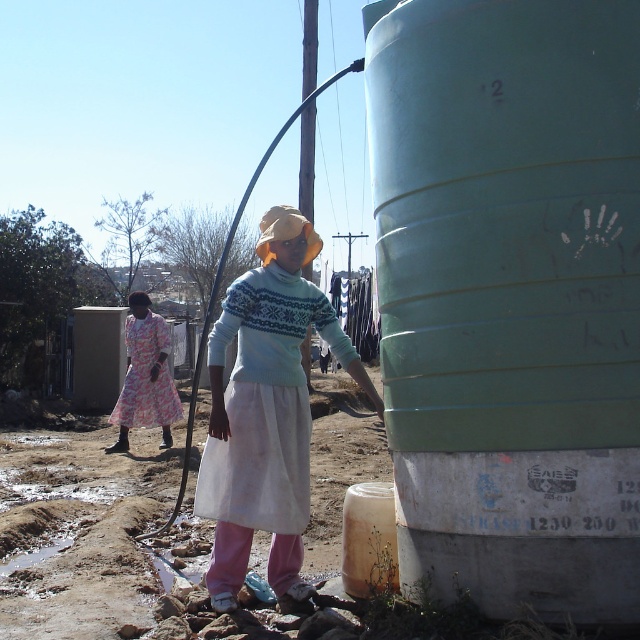
Question: Can you confirm if light blue plastic barrel at center is positioned to the right of light blue sweater at center?

Choices:
 (A) no
 (B) yes

Answer: (B)

Question: Does brown dirt at lower left appear under light blue sweater at center?

Choices:
 (A) yes
 (B) no

Answer: (A)

Question: Does light blue plastic barrel at center have a greater width compared to floral cotton dress at left?

Choices:
 (A) no
 (B) yes

Answer: (B)

Question: Which of the following is the closest to the observer?

Choices:
 (A) (170, 374)
 (B) (148, 456)

Answer: (B)

Question: Among these points, which one is farthest from the camera?

Choices:
 (A) (470, 285)
 (B) (289, 396)

Answer: (B)

Question: Which object is the farthest from the floral cotton dress at left?

Choices:
 (A) brown dirt at lower left
 (B) light blue sweater at center
 (C) light blue plastic barrel at center

Answer: (C)